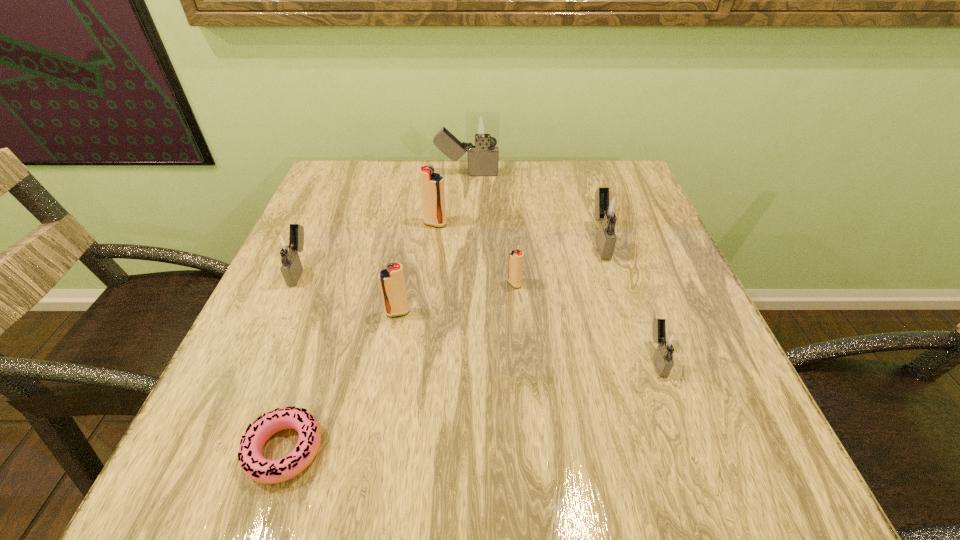
I want to click on the second nearest red igniter, so click(x=515, y=268).

Locate an element on the screen. Image resolution: width=960 pixels, height=540 pixels. the nearest gray igniter is located at coordinates (668, 343).

Image resolution: width=960 pixels, height=540 pixels. I want to click on the smallest gray igniter, so click(x=668, y=343).

Locate an element on the screen. The width and height of the screenshot is (960, 540). the nearest object is located at coordinates (255, 466).

Locate an element on the screen. This screenshot has height=540, width=960. doughnut is located at coordinates (255, 466).

Locate an element on the screen. This screenshot has width=960, height=540. vacant space located 0.230m on the right of the tallest object is located at coordinates (581, 174).

What are the coordinates of `free point located 0.130m on the back of the second red igniter from right to left` in the screenshot? It's located at (440, 190).

I want to click on free space located on the left of the third smallest gray igniter, so click(x=447, y=240).

Identify the location of free spot located on the right of the second smallest gray igniter. (437, 268).

This screenshot has height=540, width=960. Identify the location of vacant space located 0.280m on the back of the nearest red igniter. (415, 222).